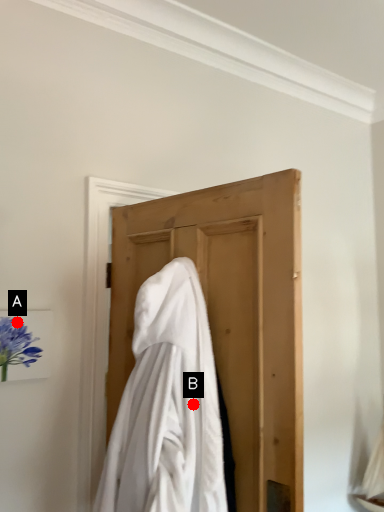
Question: Two points are circled on the image, labeled by A and B beside each circle. Which point is farther from the camera taking this photo?

Choices:
 (A) A is further
 (B) B is further

Answer: (A)